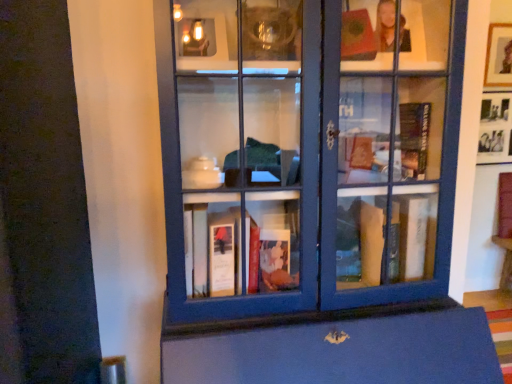
This screenshot has height=384, width=512. Describe the element at coordinates (308, 155) in the screenshot. I see `matte blue bookcase at center` at that location.

What do you see at coordinates (495, 128) in the screenshot? This screenshot has height=384, width=512. I see `black matte picture frame at upper right, arranged as the first picture frame when ordered from the bottom` at bounding box center [495, 128].

Where is `matte blue bookcase at center`? This screenshot has height=384, width=512. matte blue bookcase at center is located at coordinates (308, 155).

Relative to matte blue bookcase at center, is black matte picture frame at upper right, placed as the 2th picture frame when sorted from top to bottom, in front or behind?

Clearly, black matte picture frame at upper right, placed as the 2th picture frame when sorted from top to bottom, is behind matte blue bookcase at center.

Can you tell me how much black matte picture frame at upper right, arranged as the first picture frame when ordered from the bottom, and matte blue bookcase at center differ in facing direction?

1.81 degrees separate the facing orientations of black matte picture frame at upper right, arranged as the first picture frame when ordered from the bottom, and matte blue bookcase at center.

Which of these two, black matte picture frame at upper right, arranged as the first picture frame when ordered from the bottom, or matte blue bookcase at center, stands shorter?

black matte picture frame at upper right, arranged as the first picture frame when ordered from the bottom.

Is wooden picture frame at upper right, the 1th picture frame in the top-to-bottom sequence, with black matte picture frame at upper right, placed as the 2th picture frame when sorted from top to bottom?

wooden picture frame at upper right, the 1th picture frame in the top-to-bottom sequence, is not next to black matte picture frame at upper right, placed as the 2th picture frame when sorted from top to bottom, and they're not touching.

Considering the sizes of wooden picture frame at upper right, which is counted as the second picture frame, starting from the bottom, and black matte picture frame at upper right, placed as the 2th picture frame when sorted from top to bottom, in the image, is wooden picture frame at upper right, which is counted as the second picture frame, starting from the bottom, bigger or smaller than black matte picture frame at upper right, placed as the 2th picture frame when sorted from top to bottom,?

wooden picture frame at upper right, which is counted as the second picture frame, starting from the bottom, is smaller than black matte picture frame at upper right, placed as the 2th picture frame when sorted from top to bottom.

Which is more to the left, wooden picture frame at upper right, the 1th picture frame in the top-to-bottom sequence, or black matte picture frame at upper right, placed as the 2th picture frame when sorted from top to bottom?

wooden picture frame at upper right, the 1th picture frame in the top-to-bottom sequence.

Is black matte picture frame at upper right, placed as the 2th picture frame when sorted from top to bottom, aimed at wooden picture frame at upper right, the 1th picture frame in the top-to-bottom sequence?

No, black matte picture frame at upper right, placed as the 2th picture frame when sorted from top to bottom, is not facing towards wooden picture frame at upper right, the 1th picture frame in the top-to-bottom sequence.

Consider the image. How many degrees apart are the facing directions of black matte picture frame at upper right, arranged as the first picture frame when ordered from the bottom, and wooden picture frame at upper right, the 1th picture frame in the top-to-bottom sequence?

2.6 degrees.

Based on the photo, does black matte picture frame at upper right, placed as the 2th picture frame when sorted from top to bottom, appear on the left side of wooden picture frame at upper right, the 1th picture frame in the top-to-bottom sequence?

Incorrect, black matte picture frame at upper right, placed as the 2th picture frame when sorted from top to bottom, is not on the left side of wooden picture frame at upper right, the 1th picture frame in the top-to-bottom sequence.

Can you confirm if black matte picture frame at upper right, arranged as the first picture frame when ordered from the bottom, is wider than wooden picture frame at upper right, which is counted as the second picture frame, starting from the bottom?

Incorrect, the width of black matte picture frame at upper right, arranged as the first picture frame when ordered from the bottom, does not surpass that of wooden picture frame at upper right, which is counted as the second picture frame, starting from the bottom.

Who is smaller, matte blue bookcase at center or wooden picture frame at upper right, which is counted as the second picture frame, starting from the bottom?

With smaller size is wooden picture frame at upper right, which is counted as the second picture frame, starting from the bottom.

Locate an element on the screen. the 2nd picture frame above when counting from the matte blue bookcase at center (from the image's perspective) is located at coordinates (499, 56).

Which object is thinner, matte blue bookcase at center or wooden picture frame at upper right, the 1th picture frame in the top-to-bottom sequence?

wooden picture frame at upper right, the 1th picture frame in the top-to-bottom sequence.

Which of these two, matte blue bookcase at center or black matte picture frame at upper right, arranged as the first picture frame when ordered from the bottom, is wider?

Wider between the two is matte blue bookcase at center.

Is matte blue bookcase at center located outside black matte picture frame at upper right, placed as the 2th picture frame when sorted from top to bottom?

matte blue bookcase at center lies outside black matte picture frame at upper right, placed as the 2th picture frame when sorted from top to bottom,'s area.

Which is in front, point (421, 97) or point (503, 158)?

The point (421, 97) is closer.

What's the angular difference between matte blue bookcase at center and black matte picture frame at upper right, placed as the 2th picture frame when sorted from top to bottom,'s facing directions?

The angle between the facing direction of matte blue bookcase at center and the facing direction of black matte picture frame at upper right, placed as the 2th picture frame when sorted from top to bottom, is 1.81 degrees.

Which object is positioned more to the left, wooden picture frame at upper right, the 1th picture frame in the top-to-bottom sequence, or matte blue bookcase at center?

Positioned to the left is matte blue bookcase at center.

How much distance is there between wooden picture frame at upper right, the 1th picture frame in the top-to-bottom sequence, and matte blue bookcase at center?

The distance of wooden picture frame at upper right, the 1th picture frame in the top-to-bottom sequence, from matte blue bookcase at center is 4.72 feet.

How different are the orientations of wooden picture frame at upper right, the 1th picture frame in the top-to-bottom sequence, and matte blue bookcase at center in degrees?

0.786 degrees separate the facing orientations of wooden picture frame at upper right, the 1th picture frame in the top-to-bottom sequence, and matte blue bookcase at center.

Based on the photo, is wooden picture frame at upper right, the 1th picture frame in the top-to-bottom sequence, bigger than matte blue bookcase at center?

No, wooden picture frame at upper right, the 1th picture frame in the top-to-bottom sequence, is not bigger than matte blue bookcase at center.

This screenshot has width=512, height=384. What are the coordinates of `bookcase in front of the black matte picture frame at upper right, arranged as the first picture frame when ordered from the bottom` in the screenshot? It's located at (308, 155).

You are a GUI agent. You are given a task and a screenshot of the screen. Output one action in this format:
    pyautogui.click(x=<x>, y=<y>)
    Task: Click on the picture frame to the right of wooden picture frame at upper right, which is counted as the second picture frame, starting from the bottom
    This screenshot has height=384, width=512.
    Given the screenshot: What is the action you would take?
    pyautogui.click(x=495, y=128)

Which object lies further to the anchor point matte blue bookcase at center, wooden picture frame at upper right, the 1th picture frame in the top-to-bottom sequence, or black matte picture frame at upper right, placed as the 2th picture frame when sorted from top to bottom?

wooden picture frame at upper right, the 1th picture frame in the top-to-bottom sequence, lies further to matte blue bookcase at center than the other object.

From the image, which object appears to be nearer to black matte picture frame at upper right, arranged as the first picture frame when ordered from the bottom, wooden picture frame at upper right, the 1th picture frame in the top-to-bottom sequence, or matte blue bookcase at center?

wooden picture frame at upper right, the 1th picture frame in the top-to-bottom sequence, is positioned closer to the anchor black matte picture frame at upper right, arranged as the first picture frame when ordered from the bottom.

From the image, which object appears to be farther from wooden picture frame at upper right, which is counted as the second picture frame, starting from the bottom, matte blue bookcase at center or black matte picture frame at upper right, placed as the 2th picture frame when sorted from top to bottom?

Among the two, matte blue bookcase at center is located further to wooden picture frame at upper right, which is counted as the second picture frame, starting from the bottom.

Estimate the real-world distances between objects in this image. Which object is closer to matte blue bookcase at center, black matte picture frame at upper right, placed as the 2th picture frame when sorted from top to bottom, or wooden picture frame at upper right, which is counted as the second picture frame, starting from the bottom?

black matte picture frame at upper right, placed as the 2th picture frame when sorted from top to bottom, lies closer to matte blue bookcase at center than the other object.

Based on the photo, estimate the real-world distances between objects in this image. Which object is closer to black matte picture frame at upper right, placed as the 2th picture frame when sorted from top to bottom, matte blue bookcase at center or wooden picture frame at upper right, the 1th picture frame in the top-to-bottom sequence?

wooden picture frame at upper right, the 1th picture frame in the top-to-bottom sequence, lies closer to black matte picture frame at upper right, placed as the 2th picture frame when sorted from top to bottom, than the other object.

From the image, which object appears to be farther from wooden picture frame at upper right, the 1th picture frame in the top-to-bottom sequence, black matte picture frame at upper right, arranged as the first picture frame when ordered from the bottom, or matte blue bookcase at center?

matte blue bookcase at center is positioned further to the anchor wooden picture frame at upper right, the 1th picture frame in the top-to-bottom sequence.

In order to click on picture frame between matte blue bookcase at center and black matte picture frame at upper right, placed as the 2th picture frame when sorted from top to bottom, from front to back in this screenshot , I will do `click(499, 56)`.